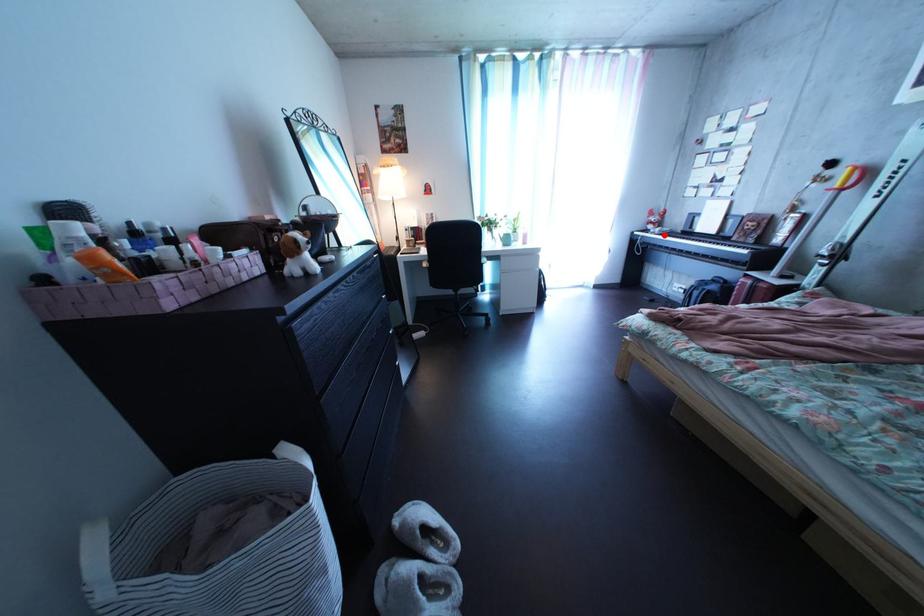
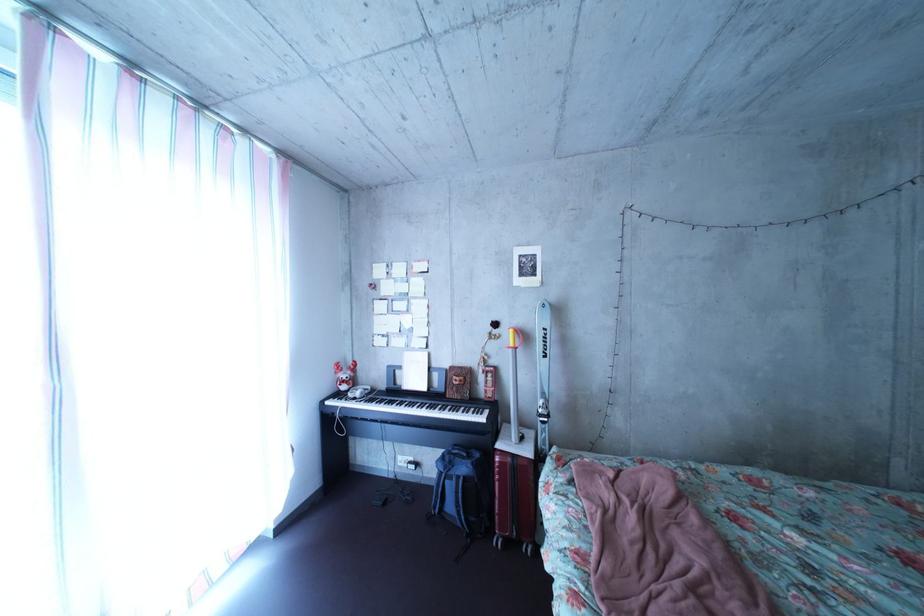
Where in the second image is the point corresponding to the highlighted location from the first image?

(358, 395)